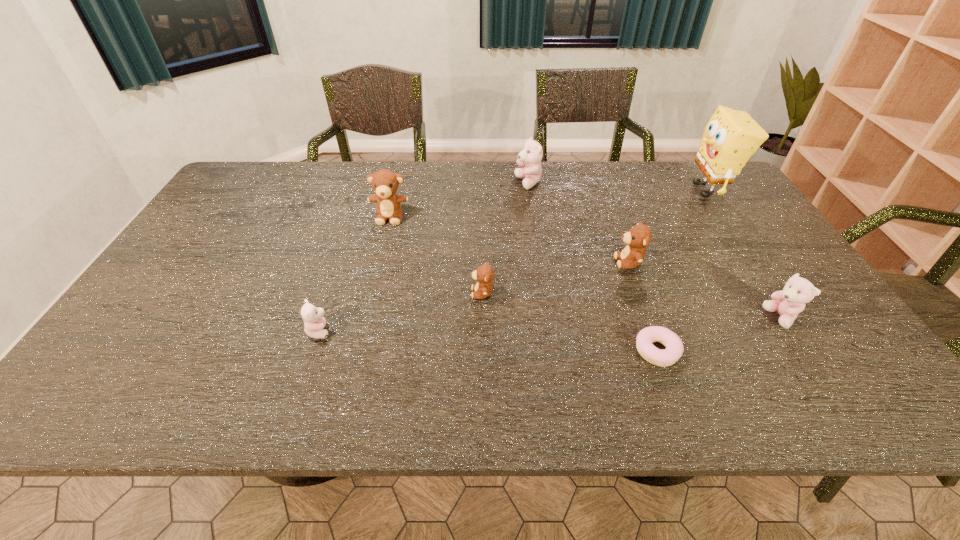
In the image, there is a desktop. What are the coordinates of `vacant space at the near edge` in the screenshot? It's located at (500, 406).

In the image, there is a desktop. Where is `vacant region at the left edge`? vacant region at the left edge is located at coordinates (156, 346).

At what (x,y) coordinates should I click in order to perform the action: click on vacant space at the far left corner of the desktop. Please return your answer as a coordinate pair (x, y). This screenshot has width=960, height=540. Looking at the image, I should click on (267, 186).

Identify the location of free space between the second brown teddy bear from left to right and the rightmost pink teddy bear. (632, 306).

Where is `free spot between the fifth object from right to left and the leftmost teddy bear`? The height and width of the screenshot is (540, 960). free spot between the fifth object from right to left and the leftmost teddy bear is located at coordinates 424,257.

Locate an element on the screen. This screenshot has width=960, height=540. free point between the leftmost brown teddy bear and the leftmost teddy bear is located at coordinates (354, 274).

Locate an element on the screen. This screenshot has height=540, width=960. free space between the rightmost teddy bear and the fourth nearest teddy bear is located at coordinates (705, 290).

Where is `vacant point located between the third farthest teddy bear and the sponge`? The width and height of the screenshot is (960, 540). vacant point located between the third farthest teddy bear and the sponge is located at coordinates (668, 226).

Find the location of a particular element. The height and width of the screenshot is (540, 960). free space between the leftmost pink teddy bear and the rightmost teddy bear is located at coordinates (550, 325).

This screenshot has height=540, width=960. Find the location of `free space between the tallest object and the leftmost teddy bear`. free space between the tallest object and the leftmost teddy bear is located at coordinates (513, 260).